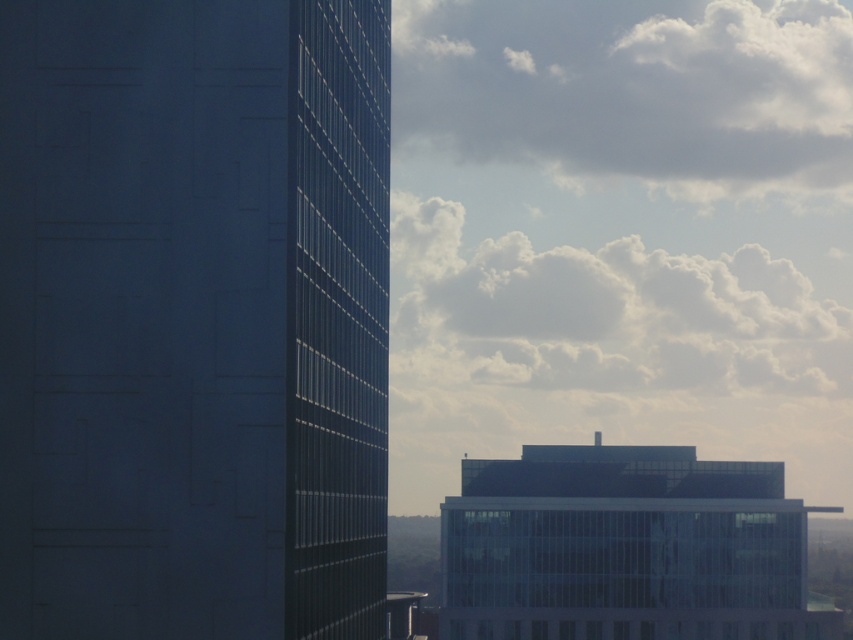
Question: Can you confirm if white fluffy cloud at upper right is smaller than transparent glass building at center?

Choices:
 (A) yes
 (B) no

Answer: (B)

Question: Does white fluffy cloud at upper right appear under white fluffy cloud at upper center?

Choices:
 (A) yes
 (B) no

Answer: (B)

Question: Based on their relative distances, which object is nearer to the dark glass building at left?

Choices:
 (A) white fluffy cloud at upper right
 (B) white fluffy cloud at upper center

Answer: (B)

Question: Considering the real-world distances, which object is closest to the transparent glass building at center?

Choices:
 (A) white fluffy cloud at upper center
 (B) dark glass building at left

Answer: (B)

Question: Which object is farther from the camera taking this photo?

Choices:
 (A) white fluffy cloud at upper center
 (B) white fluffy cloud at upper right
 (C) dark glass building at left
 (D) transparent glass building at center

Answer: (B)

Question: Can you confirm if dark glass building at left is positioned to the left of transparent glass building at center?

Choices:
 (A) yes
 (B) no

Answer: (A)